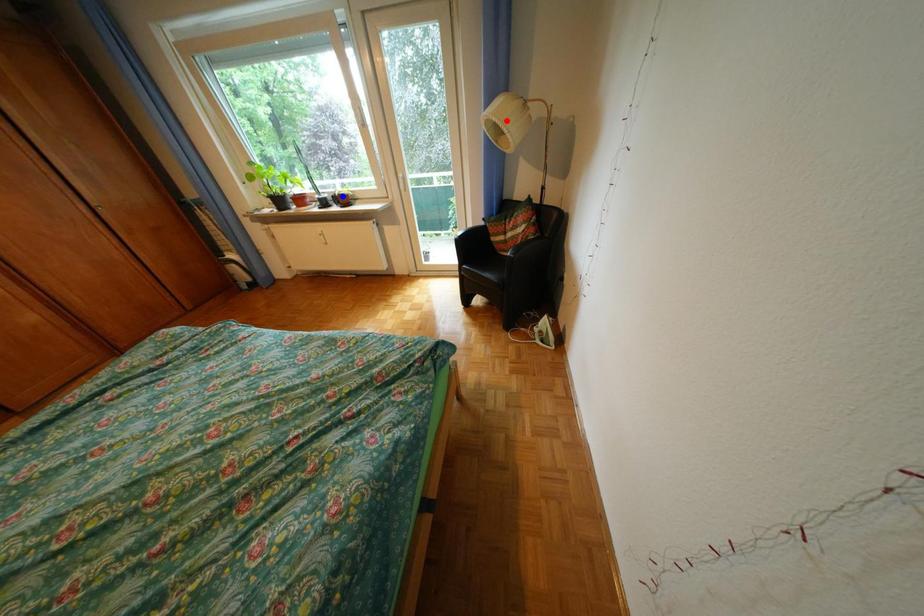
Question: In the image, two points are highlighted. Which point is nearer to the camera? Reply with the corresponding letter.

Choices:
 (A) blue point
 (B) red point

Answer: (B)